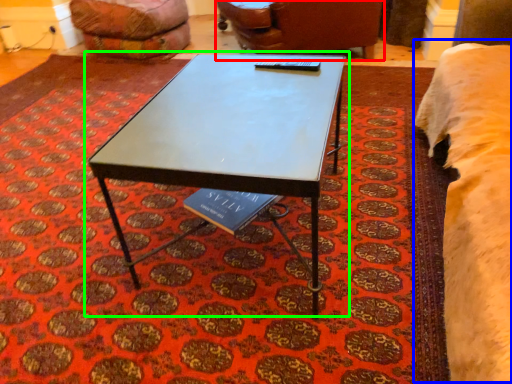
Question: Which is nearer to the chair (highlighted by a red box)? bed (highlighted by a blue box) or coffee table (highlighted by a green box).

Choices:
 (A) bed
 (B) coffee table

Answer: (A)